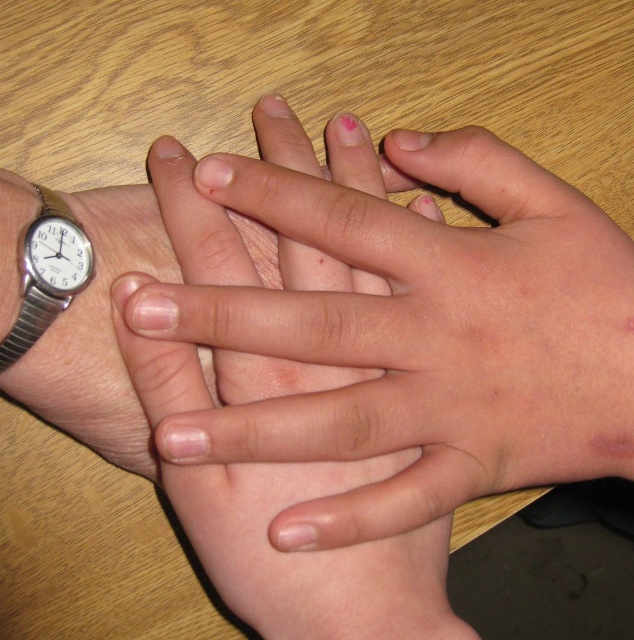
Is smooth skin hands at center below silver metallic watch at left?

Yes, smooth skin hands at center is below silver metallic watch at left.

Which is more to the left, smooth skin hands at center or silver metallic watch at left?

silver metallic watch at left is more to the left.

Between point (609, 392) and point (60, 202), which one is positioned in front?

Point (60, 202)

Where is `smooth skin hands at center`? smooth skin hands at center is located at coordinates (418, 336).